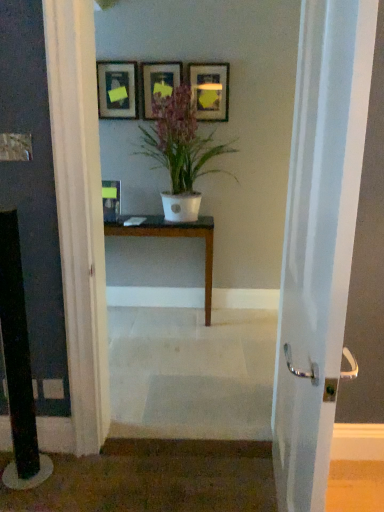
Question: Visually, is matte black picture frame at upper center, the 4th picture frame viewed from the left, positioned to the left or to the right of white matte pot at center?

Choices:
 (A) right
 (B) left

Answer: (A)

Question: Is matte black picture frame at upper center, the first picture frame when ordered from right to left, taller or shorter than white matte pot at center?

Choices:
 (A) tall
 (B) short

Answer: (B)

Question: Estimate the real-world distances between objects in this image. Which object is closer to the white matte pot at center?

Choices:
 (A) matte black picture frame at upper center, arranged as the third picture frame when viewed from the left
 (B) dark brown wood table at center
 (C) white glossy door handle at center
 (D) matte black picture frame at upper center, the 4th picture frame viewed from the left
 (E) matte black picture frame at upper left, the third picture frame in the right-to-left sequence

Answer: (D)

Question: Estimate the real-world distances between objects in this image. Which object is closer to the matte black picture frame at upper center, arranged as the third picture frame when viewed from the left?

Choices:
 (A) white glossy door handle at center
 (B) matte black picture frame at upper left, the third picture frame in the right-to-left sequence
 (C) matte black picture frame at upper center, the first picture frame when ordered from right to left
 (D) matte black picture frame at center, which is counted as the fourth picture frame, starting from the right
 (E) dark brown wood table at center

Answer: (B)